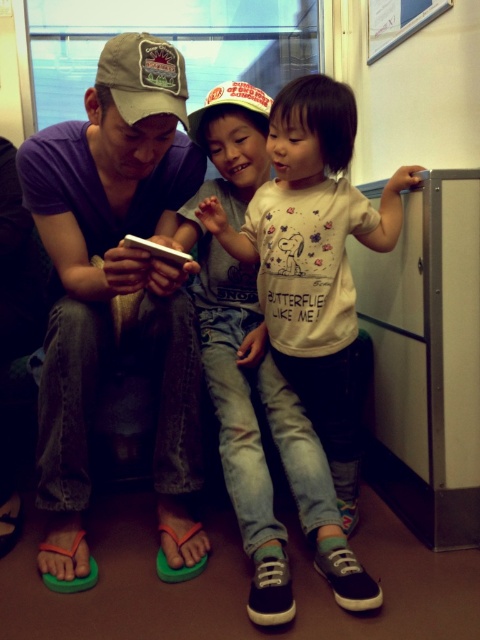
Question: Which of these objects is positioned farthest from the beige fabric baseball cap at upper left?

Choices:
 (A) white cotton shirt at center
 (B) green flip-flops at lower left
 (C) white matte baseball cap at center

Answer: (A)

Question: In this image, where is white cotton shirt at center located relative to beige fabric baseball cap at upper left?

Choices:
 (A) below
 (B) above

Answer: (A)

Question: Can you confirm if green flip-flops at lower left is positioned above white matte baseball cap at center?

Choices:
 (A) yes
 (B) no

Answer: (B)

Question: Is white cotton shirt at center below beige fabric baseball cap at upper left?

Choices:
 (A) no
 (B) yes

Answer: (B)

Question: Which object is farther from the camera taking this photo?

Choices:
 (A) beige fabric baseball cap at upper left
 (B) white cotton shirt at center
 (C) white matte baseball cap at center

Answer: (C)

Question: Which point is closer to the camera?

Choices:
 (A) green flip-flops at lower left
 (B) beige fabric baseball cap at upper left
 (C) white matte baseball cap at center

Answer: (B)